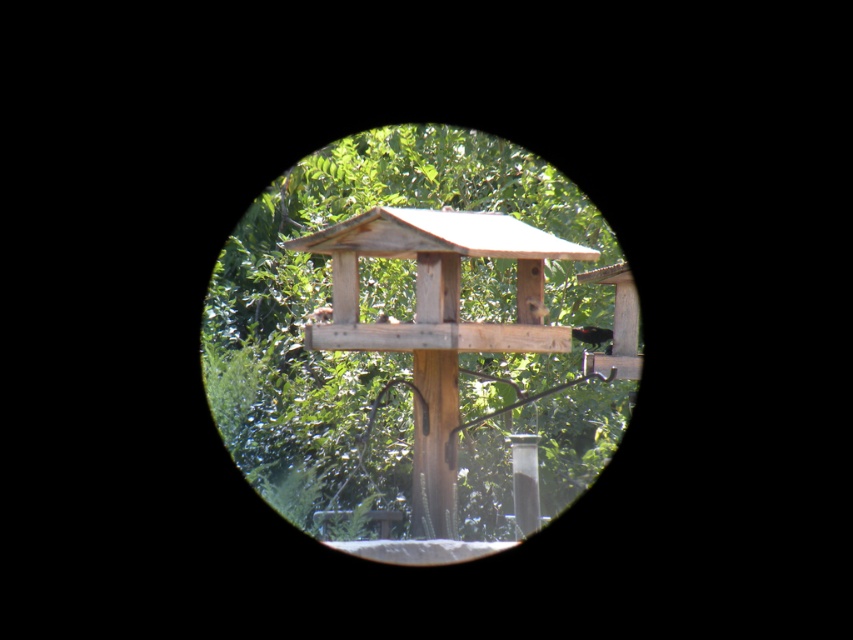
Is point (444, 188) positioned in front of point (517, 440)?

No, (444, 188) is further to viewer.

Does wooden bird feeder at center have a lesser width compared to clear glass tube at center?

In fact, wooden bird feeder at center might be wider than clear glass tube at center.

Is point (524, 177) farther from camera compared to point (531, 476)?

That is True.

Where is `wooden bird feeder at center`? wooden bird feeder at center is located at coordinates (412, 333).

Find the location of a particular element. clear glass tube at center is located at coordinates (524, 483).

Can you confirm if clear glass tube at center is positioned above brown fuzzy bird at center?

No.

Which is in front, point (518, 468) or point (318, 321)?

Point (318, 321) is in front.

Locate an element on the screen. clear glass tube at center is located at coordinates (524, 483).

From the picture: Can you confirm if brown fuzzy bird at center is taller than brown matte bird feeder at center?

Indeed, brown fuzzy bird at center has a greater height compared to brown matte bird feeder at center.

Is point (325, 310) less distant than point (387, 314)?

Yes, point (325, 310) is in front of point (387, 314).

Who is more distant from viewer, (312, 323) or (376, 317)?

The point (376, 317) is more distant.

Locate an element on the screen. The height and width of the screenshot is (640, 853). brown fuzzy bird at center is located at coordinates (320, 314).